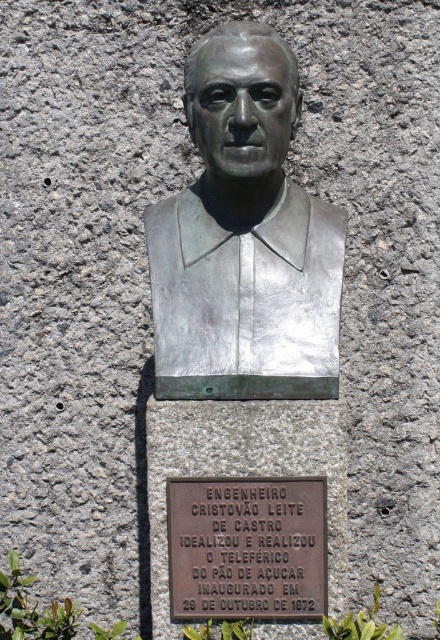
You are an art conservator assessing the space. You need to determine if the bronze bust at center can be safely moved to a new location without disturbing the bronze plaque at center. The bust weighs 200 kg and the plaque weighs 50 kg. The recommended weight limit for moving objects in this area is 150 kg. Can both items be moved safely within the weight limit?

The bronze bust at center weighs 200 kg, which exceeds the recommended weight limit of 150 kg. The bronze plaque at center weighs 50 kg, which is within the limit. Therefore, only the bronze plaque at center can be moved safely within the weight limit.

You are an art conservator examining the bronze bust at center and the bronze plaque at center mounted on the stone wall. Which object would require a ladder to clean if you can only reach up to shoulder height?

The bronze plaque at center is further away from the viewer than the bronze bust at center. Since the plaque is positioned lower but farther back, you might still need a ladder depending on its actual height from the ground. However, based on the given information, the bronze bust at center is closer, so if the plaque is at a reachable height without a ladder, the bust might not need one. The question lacks ground height details, making an exact answer impossible. However, strictly following the description